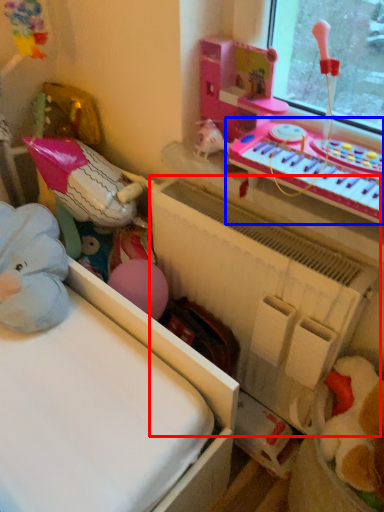
Question: Which point is closer to the camera, radiator (highlighted by a red box) or musical keyboard (highlighted by a blue box)?

Choices:
 (A) radiator
 (B) musical keyboard

Answer: (B)